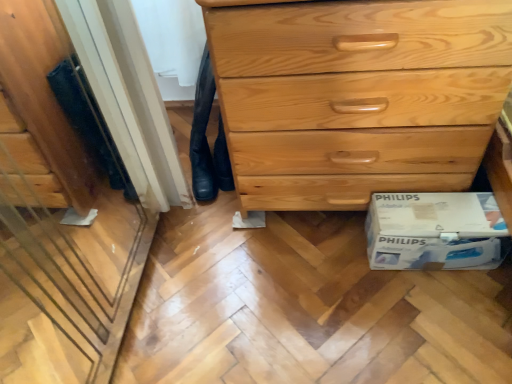
Image resolution: width=512 pixels, height=384 pixels. Identify the location of vacant space in front of white cardboard box at lower right. (442, 319).